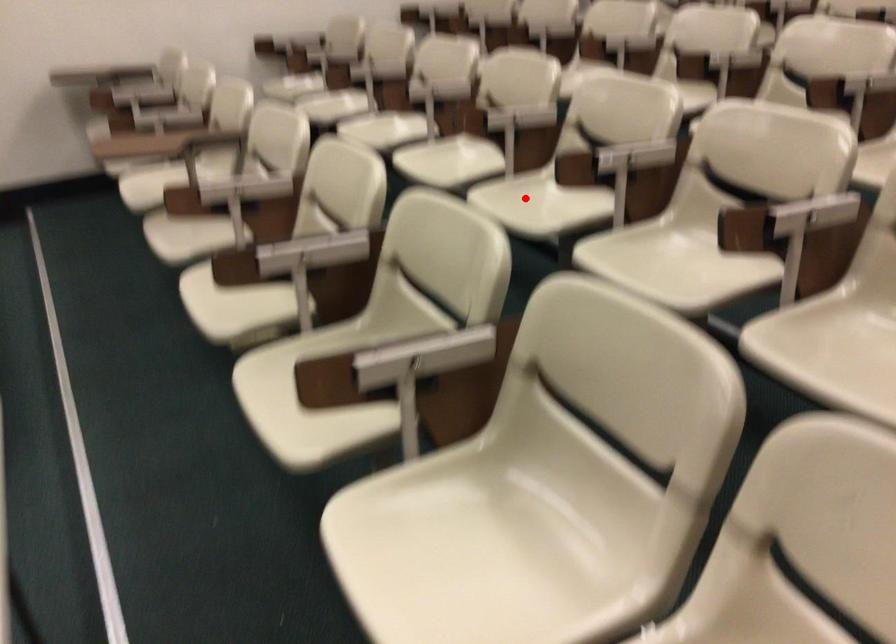
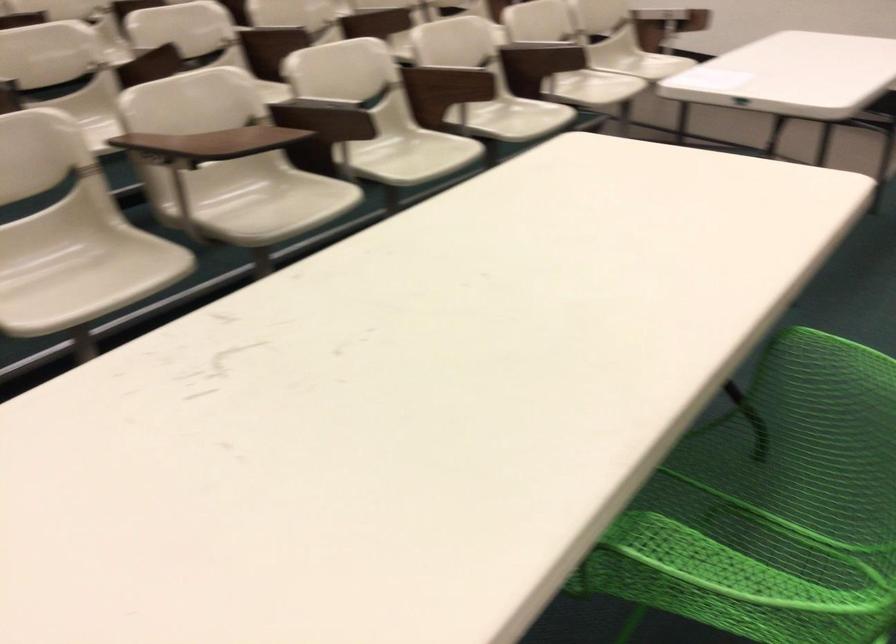
Question: I am providing you with two images of the same scene from different viewpoints. A red point is marked on the first image. Can you still see the location of the red point in image 2?

Choices:
 (A) Yes
 (B) No

Answer: (B)